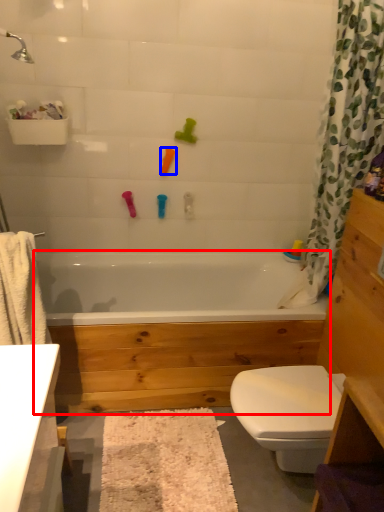
Question: Among these objects, which one is nearest to the camera, bathtub (highlighted by a red box) or toy (highlighted by a blue box)?

Choices:
 (A) bathtub
 (B) toy

Answer: (A)